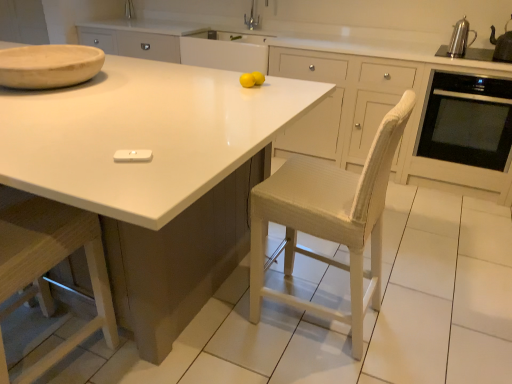
Find the location of a particular element. The image size is (512, 384). white matte remote control at center, the second appliance from the top is located at coordinates (133, 155).

You are a GUI agent. You are given a task and a screenshot of the screen. Output one action in this format:
    pyautogui.click(x=<x>, y=<y>)
    Task: Click on the natural wood bowl at upper left
    
    Given the screenshot: What is the action you would take?
    pyautogui.click(x=49, y=66)

Where is `metallic silver kettle at upper right, positioned as the 1th appliance in right-to-left order`? Image resolution: width=512 pixels, height=384 pixels. metallic silver kettle at upper right, positioned as the 1th appliance in right-to-left order is located at coordinates (502, 45).

Describe the element at coordinates (142, 135) in the screenshot. I see `white glossy countertop at center` at that location.

The height and width of the screenshot is (384, 512). Find the location of `black glass oven at right`. black glass oven at right is located at coordinates (467, 120).

This screenshot has height=384, width=512. Find the location of `white matte remote control at center, which appears as the first appliance when viewed from the front`. white matte remote control at center, which appears as the first appliance when viewed from the front is located at coordinates (133, 155).

Measure the distance between white matte sink at center and white glossy countertop at center.

The distance of white matte sink at center from white glossy countertop at center is 1.50 meters.

Is white matte sink at center to the right of white glossy countertop at center from the viewer's perspective?

Yes, white matte sink at center is to the right of white glossy countertop at center.

Considering the sizes of white matte sink at center and white glossy countertop at center in the image, is white matte sink at center taller or shorter than white glossy countertop at center?

Clearly, white matte sink at center is shorter compared to white glossy countertop at center.

Could you tell me if white matte sink at center is turned towards white glossy countertop at center?

Yes, white matte sink at center is aimed at white glossy countertop at center.

Does point (33, 84) appear closer or farther from the camera than point (24, 105)?

Clearly, point (33, 84) is more distant from the camera than point (24, 105).

Considering the relative positions of natural wood bowl at upper left and white glossy countertop at center in the image provided, is natural wood bowl at upper left to the left or to the right of white glossy countertop at center?

natural wood bowl at upper left is to the right of white glossy countertop at center.

Between natural wood bowl at upper left and white glossy countertop at center, which one has more height?

white glossy countertop at center.

Is there a large distance between natural wood bowl at upper left and white glossy countertop at center?

Actually, natural wood bowl at upper left and white glossy countertop at center are a little close together.

Is polished stainless steel kettle at upper right to the right of white glossy countertop at center from the viewer's perspective?

Correct, you'll find polished stainless steel kettle at upper right to the right of white glossy countertop at center.

From the image's perspective, is polished stainless steel kettle at upper right above or below white glossy countertop at center?

polished stainless steel kettle at upper right is situated higher than white glossy countertop at center in the image.

Would you say polished stainless steel kettle at upper right is a long distance from white glossy countertop at center?

Yes, polished stainless steel kettle at upper right and white glossy countertop at center are quite far apart.

Consider the image. Relative to white glossy countertop at center, is polished stainless steel kettle at upper right in front or behind?

Visually, polished stainless steel kettle at upper right is located behind white glossy countertop at center.

Between white glossy countertop at center and polished stainless steel kettle at upper right, which one has larger size?

white glossy countertop at center.

From a real-world perspective, which object rests below the other?

white glossy countertop at center is physically lower.

Is white glossy countertop at center positioned far away from polished stainless steel kettle at upper right?

white glossy countertop at center is positioned a significant distance from polished stainless steel kettle at upper right.

Is point (120, 204) positioned after point (454, 54)?

No, it is not.

Based on their positions, is metallic silver kettle at upper right, arranged as the second appliance when ordered from the bottom, located to the left or right of silver metallic faucet at upper center?

metallic silver kettle at upper right, arranged as the second appliance when ordered from the bottom, is to the right of silver metallic faucet at upper center.

The image size is (512, 384). There is a metallic silver kettle at upper right, the 2th appliance from the front. In order to click on faucet above it (from a real-world perspective) in this screenshot , I will do `click(252, 19)`.

Is metallic silver kettle at upper right, which is the 1th appliance in top-to-bottom order, turned away from silver metallic faucet at upper center?

No.

Which object is closer to the camera, metallic silver kettle at upper right, which is the 1th appliance in top-to-bottom order, or polished stainless steel kettle at upper right?

Positioned in front is metallic silver kettle at upper right, which is the 1th appliance in top-to-bottom order.

Does point (511, 31) appear closer or farther from the camera than point (457, 41)?

Point (511, 31) appears to be farther away from the viewer than point (457, 41).

Is metallic silver kettle at upper right, the first appliance in the back-to-front sequence, positioned with its back to polished stainless steel kettle at upper right?

No, metallic silver kettle at upper right, the first appliance in the back-to-front sequence, is not facing the opposite direction of polished stainless steel kettle at upper right.

Based on the photo, from the image's perspective, is metallic silver kettle at upper right, arranged as the second appliance when ordered from the bottom, beneath polished stainless steel kettle at upper right?

Yes.

Would you say wooden at left is to the left or to the right of white matte remote control at center, arranged as the 1th appliance when viewed from the left, in the picture?

Based on their positions, wooden at left is located to the left of white matte remote control at center, arranged as the 1th appliance when viewed from the left.

Does point (94, 235) lie in front of point (143, 149)?

No.

Locate an element on the screen. This screenshot has height=384, width=512. step stool below the white matte remote control at center, which appears as the first appliance when viewed from the front (from the image's perspective) is located at coordinates (53, 264).

At what (x,y) coordinates should I click in order to perform the action: click on cabinetry lying behind the white glossy countertop at center. Please return your answer as a coordinate pair (x, y). The image size is (512, 384). Looking at the image, I should click on pyautogui.click(x=224, y=54).

I want to click on countertop that appears below the natural wood bowl at upper left (from a real-world perspective), so click(142, 135).

Which object lies nearer to the anchor point white matte remote control at center, which appears as the first appliance when viewed from the front, wooden at left or natural wood bowl at upper left?

wooden at left lies closer to white matte remote control at center, which appears as the first appliance when viewed from the front, than the other object.

Estimate the real-world distances between objects in this image. Which object is further from polished stainless steel kettle at upper right, white matte sink at center or black glass oven at right?

white matte sink at center.

Which object lies further to the anchor point natural wood bowl at upper left, white glossy countertop at center or white matte remote control at center, which is the second appliance in back-to-front order?

white matte remote control at center, which is the second appliance in back-to-front order.

From the picture: Which object lies further to the anchor point black glass oven at right, white glossy countertop at center or wooden at left?

Based on the image, wooden at left appears to be further to black glass oven at right.

Which object lies further to the anchor point natural wood bowl at upper left, silver metallic faucet at upper center or polished stainless steel kettle at upper right?

Result: polished stainless steel kettle at upper right lies further to natural wood bowl at upper left than the other object.

Looking at the image, which one is located further to polished stainless steel kettle at upper right, metallic silver kettle at upper right, positioned as the 1th appliance in right-to-left order, or white glossy countertop at center?

white glossy countertop at center is positioned further to the anchor polished stainless steel kettle at upper right.

Which object lies nearer to the anchor point white glossy countertop at center, white matte remote control at center, the 2th appliance in the right-to-left sequence, or natural wood bowl at upper left?

natural wood bowl at upper left is positioned closer to the anchor white glossy countertop at center.

Estimate the real-world distances between objects in this image. Which object is closer to metallic silver kettle at upper right, the first appliance in the back-to-front sequence, white glossy countertop at center or silver metallic faucet at upper center?

silver metallic faucet at upper center lies closer to metallic silver kettle at upper right, the first appliance in the back-to-front sequence, than the other object.

Where is `step stool between white glossy countertop at center and silver metallic faucet at upper center in the front-back direction`? The width and height of the screenshot is (512, 384). step stool between white glossy countertop at center and silver metallic faucet at upper center in the front-back direction is located at coordinates (53, 264).

Image resolution: width=512 pixels, height=384 pixels. What are the coordinates of `bowl between white matte remote control at center, positioned as the first appliance in bottom-to-top order, and white matte sink at center in the front-back direction` in the screenshot? It's located at (49, 66).

Locate an element on the screen. The width and height of the screenshot is (512, 384). cabinetry situated between natural wood bowl at upper left and metallic silver kettle at upper right, the 2th appliance from the front, from left to right is located at coordinates (224, 54).

Find the location of a particular element. This screenshot has width=512, height=384. bowl between wooden at left and silver metallic faucet at upper center along the z-axis is located at coordinates (49, 66).